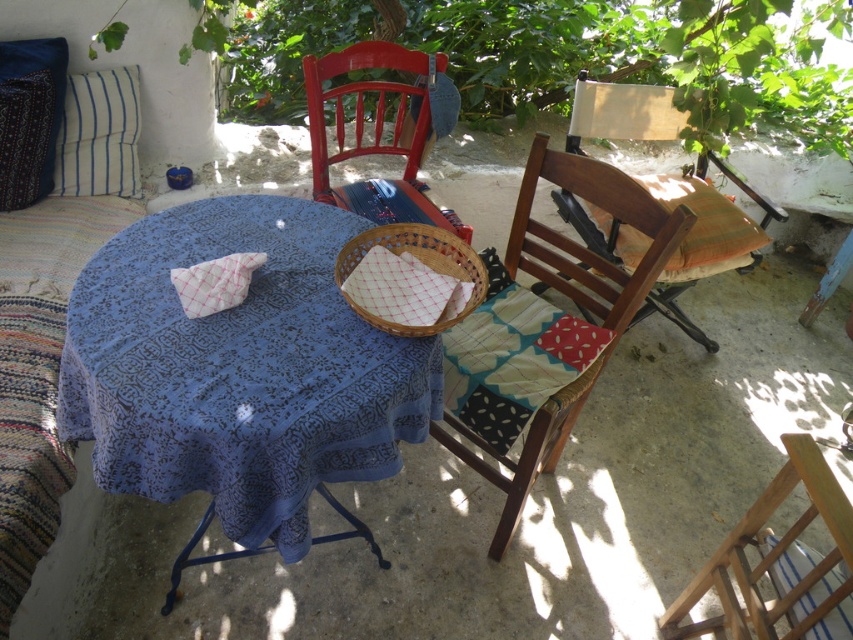
Question: Which point is closer to the camera?

Choices:
 (A) (848, 627)
 (B) (418, 200)
 (C) (209, 272)
 (D) (703, 228)

Answer: (A)

Question: Among these points, which one is farthest from the camera?

Choices:
 (A) (221, 257)
 (B) (633, 179)
 (C) (598, 308)

Answer: (C)

Question: Is matte wooden chair at center below white checkered cloth at center?

Choices:
 (A) no
 (B) yes

Answer: (A)

Question: Is woven wood chair at center in front of wooden chair at center?

Choices:
 (A) no
 (B) yes

Answer: (A)

Question: Does wooden cushioned chair at center lie behind matte wooden chair at center?

Choices:
 (A) no
 (B) yes

Answer: (B)

Question: Among these objects, which one is farthest from the camera?

Choices:
 (A) blue patterned fabric pillow at upper left
 (B) blue striped pillow at upper left

Answer: (B)